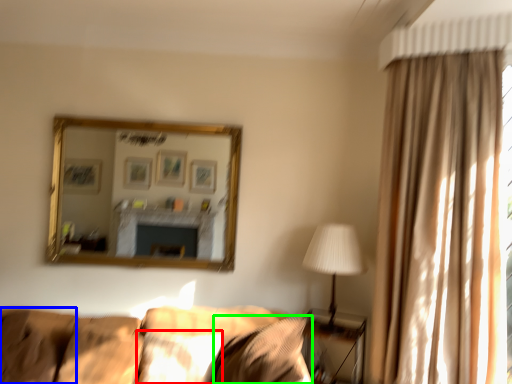
Question: Considering the real-world distances, which object is closest to pillow (highlighted by a red box)? pillow (highlighted by a blue box) or pillow (highlighted by a green box).

Choices:
 (A) pillow
 (B) pillow

Answer: (B)